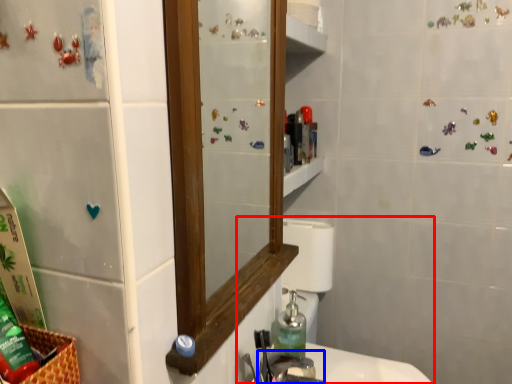
Question: Which of the following is the closest to the observer, sink (highlighted by a red box) or faucet (highlighted by a blue box)?

Choices:
 (A) sink
 (B) faucet

Answer: (B)